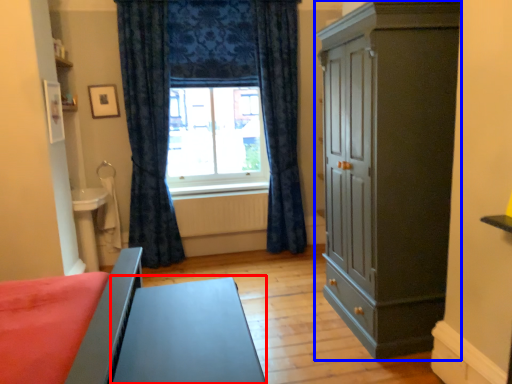
Question: Which of the following is the farthest to the observer, table (highlighted by a red box) or cupboard (highlighted by a blue box)?

Choices:
 (A) table
 (B) cupboard

Answer: (B)